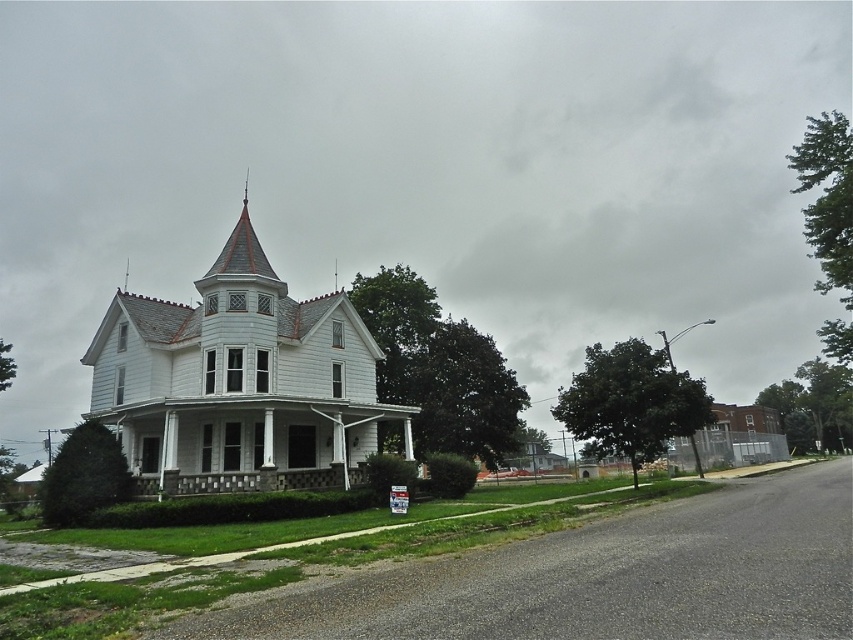
Question: Among these points, which one is farthest from the camera?

Choices:
 (A) pyautogui.click(x=195, y=481)
 (B) pyautogui.click(x=184, y=440)
 (C) pyautogui.click(x=165, y=444)

Answer: (B)

Question: Can you confirm if white painted wood porch at center is positioned below gray stone porch at lower center?

Choices:
 (A) yes
 (B) no

Answer: (A)

Question: Can you confirm if white painted wood porch at center is positioned above gray stone porch at lower center?

Choices:
 (A) yes
 (B) no

Answer: (B)

Question: Which point is closer to the camera?

Choices:
 (A) (192, 493)
 (B) (102, 330)
 (C) (410, 406)

Answer: (A)

Question: Is white painted wood porch at center bigger than gray stone porch at lower center?

Choices:
 (A) yes
 (B) no

Answer: (A)

Question: Which object is positioned farthest from the white shingles at upper center?

Choices:
 (A) white painted wood porch at center
 (B) gray stone porch at lower center

Answer: (B)